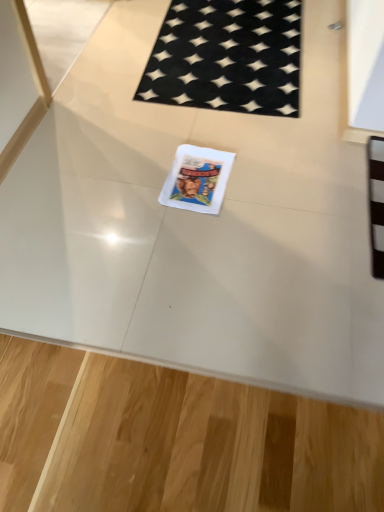
At what (x,y) coordinates should I click in order to perform the action: click on empty space that is ontop of black woven mat at upper center (from a real-world perspective). Please return your answer as a coordinate pair (x, y). This screenshot has width=384, height=512. Looking at the image, I should click on (226, 53).